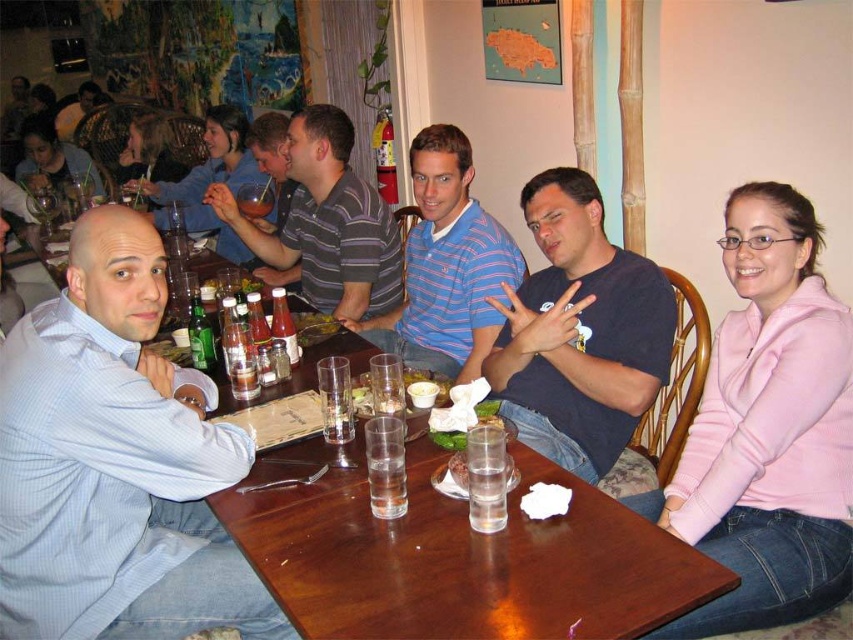
Question: Is pink fleece jacket at right wider than blue striped polo shirt at center?

Choices:
 (A) no
 (B) yes

Answer: (A)

Question: Does wooden table at center lie in front of pink fleece jacket at right?

Choices:
 (A) no
 (B) yes

Answer: (B)

Question: Can you confirm if pink fleece jacket at right is positioned above striped polo shirt at center?

Choices:
 (A) yes
 (B) no

Answer: (B)

Question: Among these objects, which one is farthest from the camera?

Choices:
 (A) matte black shirt at upper left
 (B) clear glass water at table center
 (C) light blue checkered shirt at left
 (D) wooden table at center

Answer: (A)

Question: Based on their relative distances, which object is farther from the matte black shirt at center?

Choices:
 (A) clear glass water at table center
 (B) wooden table at center
 (C) translucent glass beverage at table center

Answer: (A)

Question: Which object appears farthest from the camera in this image?

Choices:
 (A) pink fleece jacket at right
 (B) clear glass water at table center
 (C) light blue checkered shirt at left
 (D) matte black shirt at center

Answer: (D)